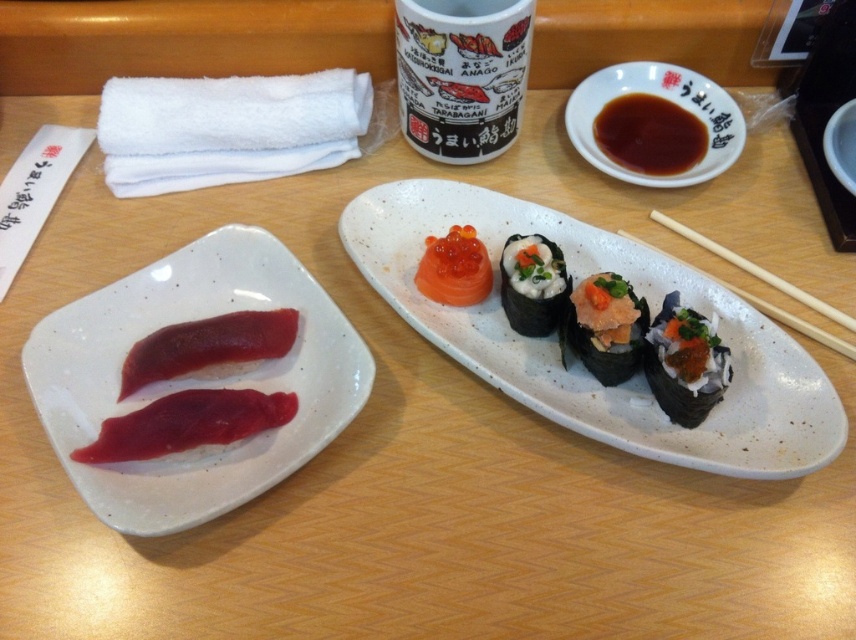
Question: Considering the real-world distances, which object is closest to the shiny black sushi at center?

Choices:
 (A) shiny salmon at center
 (B) raw red fish at lower left
 (C) white ceramic cup at upper center

Answer: (A)

Question: Which of the following is the farthest from the observer?

Choices:
 (A) white rice ball at center
 (B) white speckled ceramic plate at upper center
 (C) brown ceramic bowl at upper right
 (D) shiny salmon at center

Answer: (C)

Question: Which of these objects is positioned closest to the white ceramic cup at upper center?

Choices:
 (A) brown ceramic bowl at upper right
 (B) white rice ball at center
 (C) white speckled ceramic plate at upper center
 (D) shiny black sushi at center

Answer: (A)

Question: Is white speckled ceramic plate at upper center further to camera compared to pink raw fish at left?

Choices:
 (A) yes
 (B) no

Answer: (B)

Question: Does smooth white plate at left have a lesser width compared to shiny brown sauce at upper right?

Choices:
 (A) no
 (B) yes

Answer: (A)

Question: From the image, what is the correct spatial relationship of white ceramic cup at upper center in relation to shiny salmon at center?

Choices:
 (A) left
 (B) right

Answer: (A)